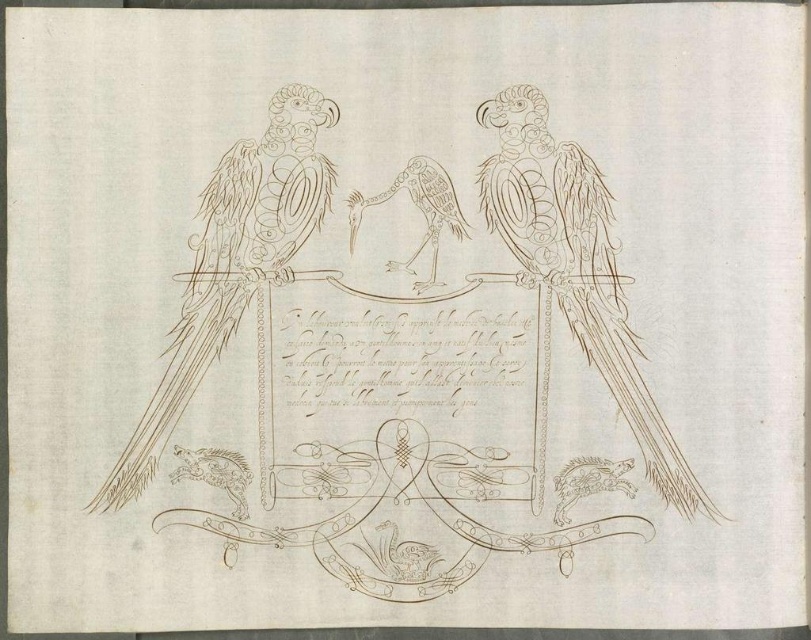
Question: Which object is farther from the camera taking this photo?

Choices:
 (A) brown textured parrot at center
 (B) smooth brown parrot at center

Answer: (B)

Question: Can you confirm if brown textured parrot at center is bigger than smooth brown parrot at center?

Choices:
 (A) no
 (B) yes

Answer: (B)

Question: Which point is farther to the camera?

Choices:
 (A) (355, 218)
 (B) (179, 356)

Answer: (A)

Question: Can you confirm if brown textured parrot at center is positioned to the right of smooth brown parrot at center?

Choices:
 (A) yes
 (B) no

Answer: (A)

Question: Which point appears closest to the camera in this image?

Choices:
 (A) (561, 305)
 (B) (311, 204)

Answer: (B)

Question: Is brown textured parrot at center to the right of brown line art parrot at left from the viewer's perspective?

Choices:
 (A) yes
 (B) no

Answer: (A)